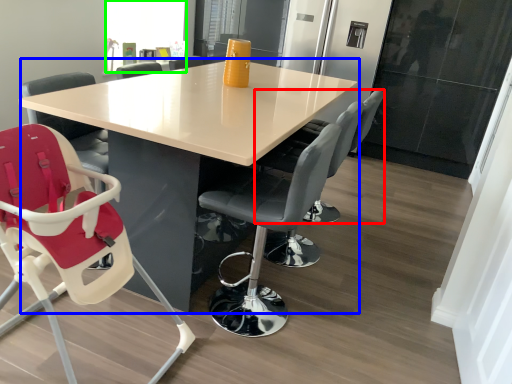
Question: Estimate the real-world distances between objects in this image. Which object is closer to chair (highlighted by a red box), table (highlighted by a blue box) or window screen (highlighted by a green box)?

Choices:
 (A) table
 (B) window screen

Answer: (A)